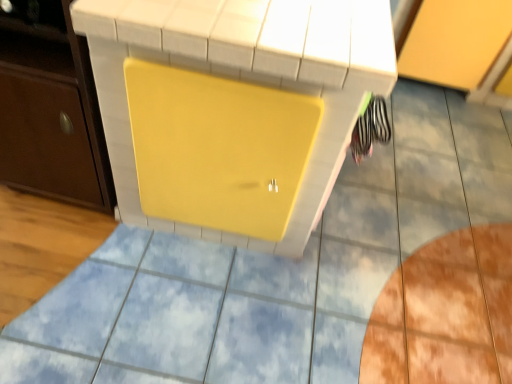
Question: From the image's perspective, is yellow matte cabinet at upper right, the second cabinetry from the left, above or below yellow matte vanity at center?

Choices:
 (A) below
 (B) above

Answer: (B)

Question: In terms of size, does yellow matte cabinet at upper right, which ranks as the first cabinetry in back-to-front order, appear bigger or smaller than yellow matte vanity at center?

Choices:
 (A) small
 (B) big

Answer: (A)

Question: Which object is positioned farthest from the yellow matte vanity at center?

Choices:
 (A) yellow matte cabinet at upper right, which ranks as the first cabinetry in back-to-front order
 (B) matte brown cabinet at left, the 1th cabinetry positioned from the front

Answer: (A)

Question: Which object is the farthest from the matte brown cabinet at left, the 1th cabinetry positioned from the front?

Choices:
 (A) yellow matte cabinet at upper right, which is the 2th cabinetry in front-to-back order
 (B) yellow matte vanity at center

Answer: (A)